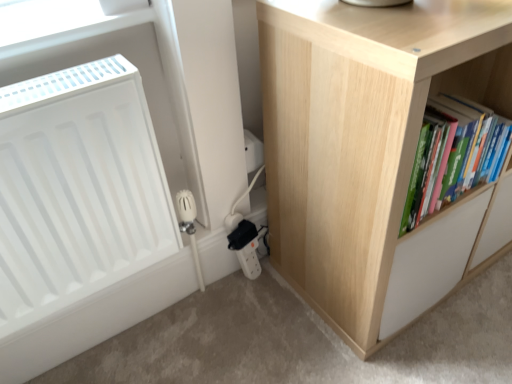
Question: Considering the relative positions of natural wood cupboard at right and green matte book at right in the image provided, is natural wood cupboard at right to the left or to the right of green matte book at right?

Choices:
 (A) right
 (B) left

Answer: (A)

Question: From a real-world perspective, is natural wood cupboard at right physically located above or below green matte book at right?

Choices:
 (A) above
 (B) below

Answer: (B)

Question: Estimate the real-world distances between objects in this image. Which object is closer to the natural wood cupboard at right?

Choices:
 (A) green matte book at right
 (B) white matte radiator at left

Answer: (A)

Question: Which is farther from the natural wood cupboard at right?

Choices:
 (A) green matte book at right
 (B) white matte radiator at left

Answer: (B)